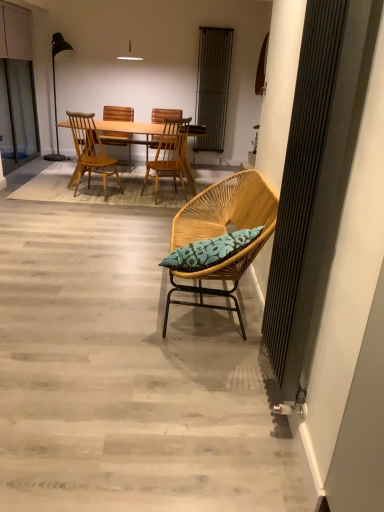
Describe the element at coordinates (20, 113) in the screenshot. I see `transparent glass screen door at left` at that location.

In order to face light brown wood chair at center, the third chair when ordered from back to front, should I rotate leftwards or rightwards?

You should rotate left by 12.822 degrees.

The image size is (384, 512). What do you see at coordinates (165, 115) in the screenshot?
I see `wooden beach chair at center` at bounding box center [165, 115].

In order to face wooden beach chair at center, should I rotate leftwards or rightwards?

Rotate your view left by about 3.449°.

Find the location of a particular element. This screenshot has width=384, height=512. metallic silver radiator at upper center is located at coordinates (213, 87).

Is matte black floor lamp at left positioned before transparent glass screen door at left?

No, it is behind transparent glass screen door at left.

From the image's perspective, which one is positioned lower, matte black floor lamp at left or transparent glass screen door at left?

transparent glass screen door at left.

Identify the location of screen door located below the matte black floor lamp at left (from the image's perspective). The width and height of the screenshot is (384, 512). (20, 113).

Considering the sizes of objects wooden chair at center, the third chair viewed from the front, and light wood table at center in the image provided, who is thinner, wooden chair at center, the third chair viewed from the front, or light wood table at center?

Thinner between the two is wooden chair at center, the third chair viewed from the front.

Are wooden chair at center, the third chair viewed from the front, and light wood table at center beside each other?

No, wooden chair at center, the third chair viewed from the front, is not touching light wood table at center.

Consider the image. Can you confirm if wooden chair at center, which appears as the second chair when viewed from the back, is taller than light wood table at center?

Indeed, wooden chair at center, which appears as the second chair when viewed from the back, has a greater height compared to light wood table at center.

From the image's perspective, which is above, wooden chair at center, which appears as the second chair when viewed from the back, or light wood table at center?

light wood table at center is shown above in the image.

Considering the positions of objects transparent glass screen door at left and woven wood chair with blue cushion at center, the 4th chair viewed from the back, in the image provided, who is behind, transparent glass screen door at left or woven wood chair with blue cushion at center, the 4th chair viewed from the back,?

Positioned behind is transparent glass screen door at left.

Is transparent glass screen door at left taller than woven wood chair with blue cushion at center, marked as the 1th chair in a front-to-back arrangement?

Correct, transparent glass screen door at left is much taller as woven wood chair with blue cushion at center, marked as the 1th chair in a front-to-back arrangement.

Which object is thinner, transparent glass screen door at left or woven wood chair with blue cushion at center, marked as the 1th chair in a front-to-back arrangement?

transparent glass screen door at left is thinner.

In order to click on screen door located behind the woven wood chair with blue cushion at center, the 4th chair viewed from the back in this screenshot , I will do `click(20, 113)`.

Does light brown wood chair at center, the third chair when ordered from back to front, touch metallic silver radiator at upper center?

No, light brown wood chair at center, the third chair when ordered from back to front, is not in contact with metallic silver radiator at upper center.

Based on the photo, is light brown wood chair at center, the third chair when ordered from back to front, located outside metallic silver radiator at upper center?

Absolutely, light brown wood chair at center, the third chair when ordered from back to front, is external to metallic silver radiator at upper center.

How different are the orientations of light brown wood chair at center, which is the 2th chair from front to back, and metallic silver radiator at upper center in degrees?

168 degrees.

Where is `beach chair on the right of the light brown wood chair at center, which is the 2th chair from front to back`? The width and height of the screenshot is (384, 512). beach chair on the right of the light brown wood chair at center, which is the 2th chair from front to back is located at coordinates tap(165, 115).

Is light brown wood chair at center, the third chair when ordered from back to front, at the back of wooden beach chair at center?

No.

Considering the sizes of objects wooden beach chair at center and light brown wood chair at center, the third chair when ordered from back to front, in the image provided, who is wider, wooden beach chair at center or light brown wood chair at center, the third chair when ordered from back to front,?

With larger width is wooden beach chair at center.

Is wooden beach chair at center touching light brown wood chair at center, which is the 2th chair from front to back?

No, wooden beach chair at center is not next to light brown wood chair at center, which is the 2th chair from front to back.

Does point (83, 131) come farther from viewer compared to point (33, 136)?

No, it is in front of (33, 136).

From the image's perspective, would you say light brown wood chair at center, which is the 2th chair from front to back, is shown under transparent glass screen door at left?

Yes, from the image's perspective, light brown wood chair at center, which is the 2th chair from front to back, is beneath transparent glass screen door at left.

Would you say light brown wood chair at center, the third chair when ordered from back to front, is to the left or to the right of transparent glass screen door at left in the picture?

Clearly, light brown wood chair at center, the third chair when ordered from back to front, is on the right of transparent glass screen door at left in the image.

Considering the positions of objects light brown wood chair at center, which is the 2th chair from front to back, and transparent glass screen door at left in the image provided, who is behind, light brown wood chair at center, which is the 2th chair from front to back, or transparent glass screen door at left?

transparent glass screen door at left is further away from the camera.

Where is `lamp below the metallic silver radiator at upper center (from a real-world perspective)`? Image resolution: width=384 pixels, height=512 pixels. lamp below the metallic silver radiator at upper center (from a real-world perspective) is located at coordinates (55, 89).

Which point is more forward, (54, 76) or (208, 138)?

Point (54, 76)

Is matte black floor lamp at left located outside metallic silver radiator at upper center?

matte black floor lamp at left is positioned outside metallic silver radiator at upper center.

The height and width of the screenshot is (512, 384). What are the coordinates of `screen door in front of the matte black floor lamp at left` in the screenshot? It's located at click(x=20, y=113).

Identify the location of desk behind the wooden chair at center, the third chair viewed from the front. This screenshot has width=384, height=512. (130, 132).

Looking at the image, which one is located closer to wooden chair at center, placed as the first chair when sorted from back to front, wooden beach chair at center or woven wood chair with blue cushion at center, the 4th chair viewed from the back?

wooden beach chair at center is closer to wooden chair at center, placed as the first chair when sorted from back to front.

Estimate the real-world distances between objects in this image. Which object is closer to wooden chair at center, the third chair viewed from the front, light wood table at center or wooden beach chair at center?

wooden beach chair at center is closer to wooden chair at center, the third chair viewed from the front.

Considering their positions, is woven wood chair with blue cushion at center, marked as the 1th chair in a front-to-back arrangement, positioned further to metallic silver radiator at upper center than light wood table at center?

woven wood chair with blue cushion at center, marked as the 1th chair in a front-to-back arrangement.

Based on their spatial positions, is wooden chair at center, the third chair viewed from the front, or woven wood chair with blue cushion at center, the 4th chair viewed from the back, closer to transparent glass screen door at left?

wooden chair at center, the third chair viewed from the front, is closer to transparent glass screen door at left.

When comparing their distances from matte black floor lamp at left, does wooden chair at center, the third chair viewed from the front, or woven wood chair with blue cushion at center, the 4th chair viewed from the back, seem further?

Based on the image, woven wood chair with blue cushion at center, the 4th chair viewed from the back, appears to be further to matte black floor lamp at left.

From the picture: Which object lies further to the anchor point matte black floor lamp at left, light brown wood chair at center, which is the 2th chair from front to back, or light wood table at center?

The object further to matte black floor lamp at left is light wood table at center.

From the image, which object appears to be farther from light brown wood chair at center, which is the 2th chair from front to back, wooden chair at center, arranged as the 4th chair when viewed from the front, or green leafy plant at upper right?

green leafy plant at upper right lies further to light brown wood chair at center, which is the 2th chair from front to back, than the other object.

When comparing their distances from light brown wood chair at center, the third chair when ordered from back to front, does light wood table at center or woven wood chair with blue cushion at center, the 4th chair viewed from the back, seem further?

Based on the image, woven wood chair with blue cushion at center, the 4th chair viewed from the back, appears to be further to light brown wood chair at center, the third chair when ordered from back to front.

Locate an element on the screen. The height and width of the screenshot is (512, 384). lamp between transparent glass screen door at left and wooden beach chair at center from left to right is located at coordinates (55, 89).

Find the location of a particular element. This screenshot has width=384, height=512. desk between wooden chair at center, which appears as the second chair when viewed from the back, and wooden chair at center, arranged as the 4th chair when viewed from the front, in the front-back direction is located at coordinates (130, 132).

Find the location of a particular element. Image resolution: width=384 pixels, height=512 pixels. desk between green leafy plant at upper right and metallic silver radiator at upper center in the front-back direction is located at coordinates (130, 132).

This screenshot has height=512, width=384. I want to click on lamp between woven wood chair with blue cushion at center, marked as the 1th chair in a front-to-back arrangement, and metallic silver radiator at upper center in the front-back direction, so click(55, 89).